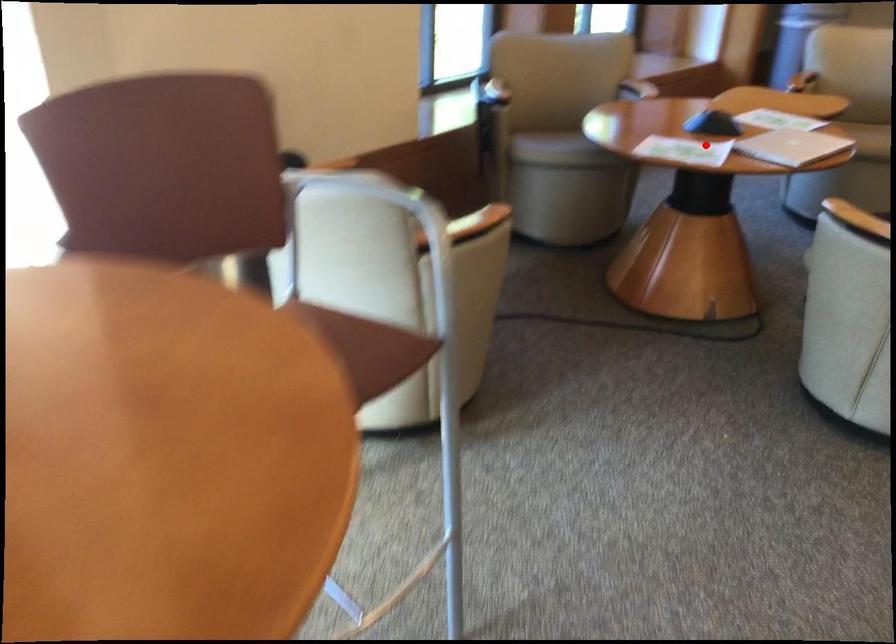
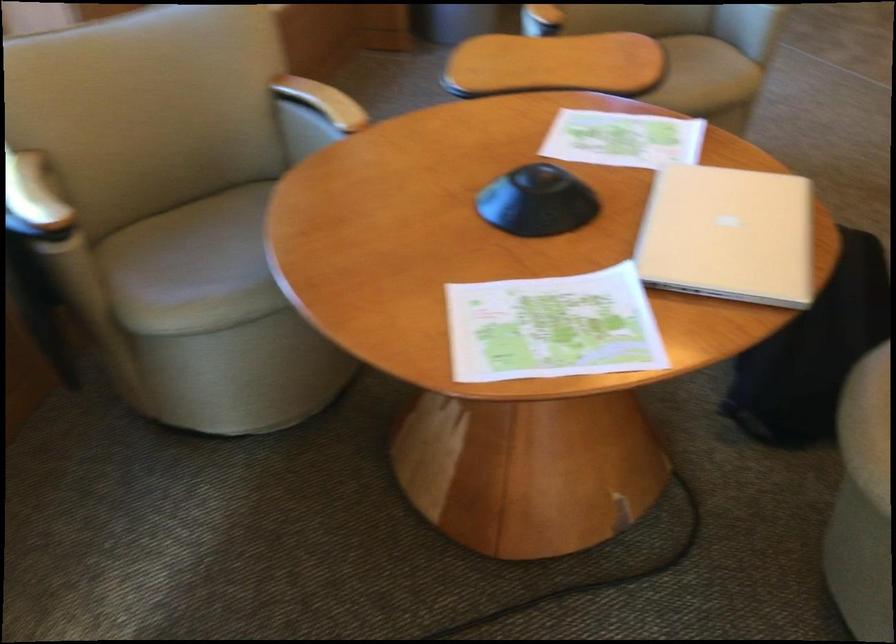
Question: I am providing you with two images of the same scene from different viewpoints. In image1, a red point is highlighted. Considering the same 3D point in image2, which of the following is correct?

Choices:
 (A) It is closer
 (B) It is farther

Answer: (A)